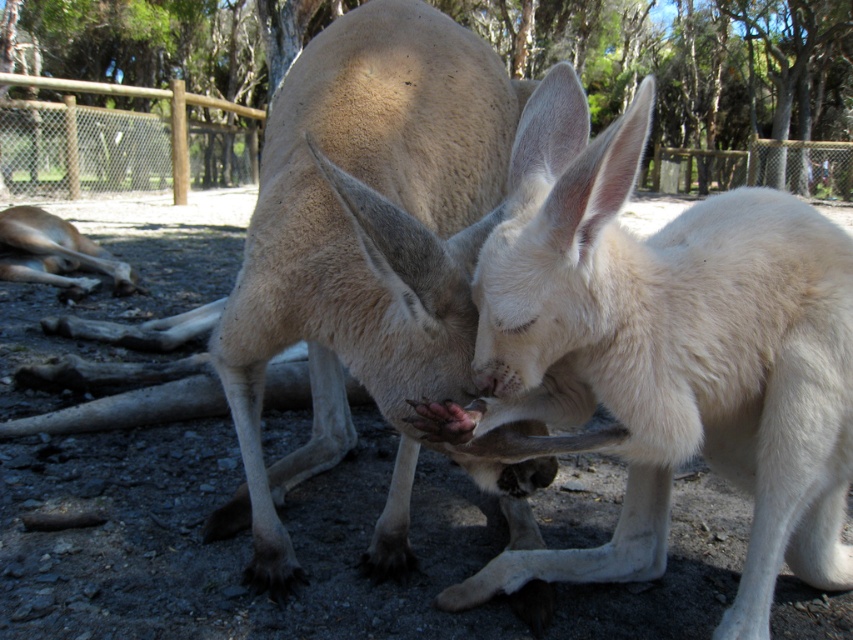
Can you confirm if light brown fur at center is positioned to the right of wooden fence at upper left?

Indeed, light brown fur at center is positioned on the right side of wooden fence at upper left.

Can you confirm if light brown fur at center is positioned to the left of wooden fence at upper left?

In fact, light brown fur at center is to the right of wooden fence at upper left.

Image resolution: width=853 pixels, height=640 pixels. Find the location of `light brown fur at center`. light brown fur at center is located at coordinates (364, 252).

Identify the location of light brown fur at center. (364, 252).

Between light brown fur at lower left and wooden fence at upper left, which one appears on the left side from the viewer's perspective?

wooden fence at upper left is more to the left.

Is light brown fur at lower left in front of wooden fence at upper left?

Yes.

Measure the distance between light brown fur at lower left and camera.

They are 14.36 feet apart.

You are a GUI agent. You are given a task and a screenshot of the screen. Output one action in this format:
    pyautogui.click(x=<x>, y=<y>)
    Task: Click on the light brown fur at lower left
    
    Given the screenshot: What is the action you would take?
    pyautogui.click(x=54, y=253)

Is white fur kangaroo at center positioned before light brown fur at lower left?

That is True.

Who is higher up, white fur kangaroo at center or light brown fur at lower left?

light brown fur at lower left is higher up.

Which is behind, point (694, 364) or point (96, 280)?

The point (96, 280) is behind.

I want to click on white fur kangaroo at center, so click(664, 353).